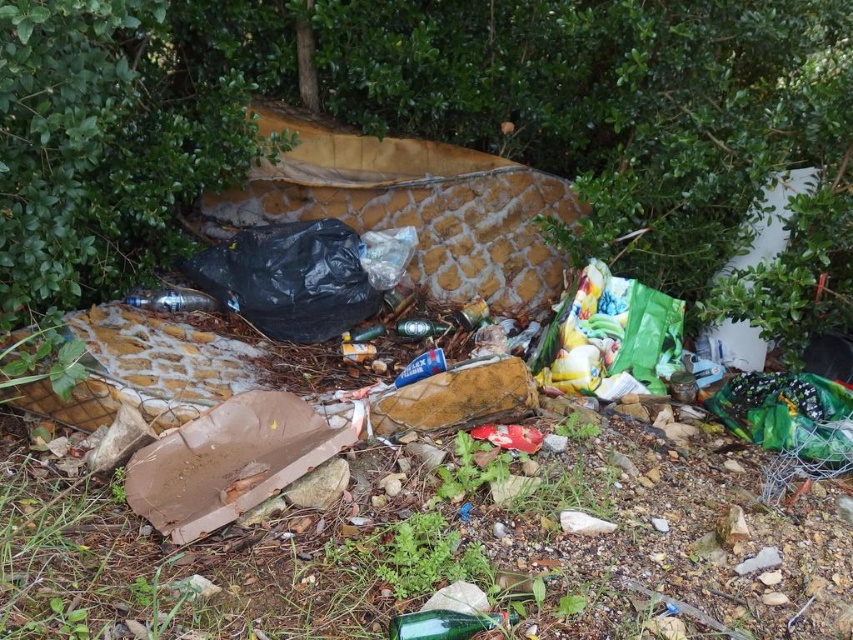
You are standing at the viewpoint of the image and want to walk towards the point that is closer to the discarded mattress. Which point should you walk towards, point (462, 625) or point (433, 323)?

Point (462, 625) is in front of point (433, 323), so you should walk towards point (462, 625) to get closer to the discarded mattress.

You are a drone operator trying to capture a clear photo of the discarded mattress in this scene. You have two points marked for focus adjustment. The first point is at coordinates point (x=175, y=122), and the second is at point (x=448, y=625). Which point should you focus on to ensure the mattress is in sharp focus?

You should focus on point (x=175, y=122) because it is closer to the camera than point (x=448, y=625), ensuring the mattress appears sharper in the photo.

You are a waste collector who needs to pick up the black plastic bag at center and the green glass bottle at lower center. Which object requires a larger trash bag to be properly contained?

The black plastic bag at center requires a larger trash bag because its width is larger than the green glass bottle at lower center.